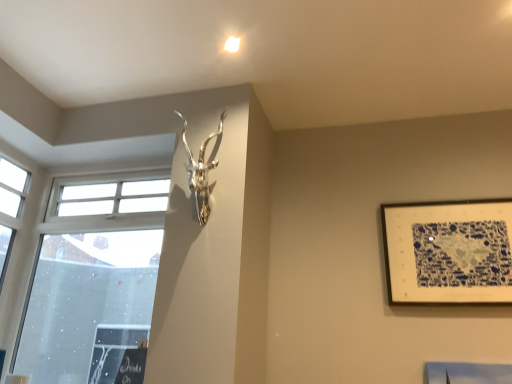
What do you see at coordinates (92, 278) in the screenshot? This screenshot has height=384, width=512. I see `transparent glass window at left` at bounding box center [92, 278].

This screenshot has height=384, width=512. I want to click on blue and white paper at upper right, so click(x=449, y=251).

Is blue and white paper at upper right bigger or smaller than silver metallic antler at upper center?

In the image, blue and white paper at upper right appears to be smaller than silver metallic antler at upper center.

Considering the positions of objects blue and white paper at upper right and silver metallic antler at upper center in the image provided, who is in front, blue and white paper at upper right or silver metallic antler at upper center?

silver metallic antler at upper center.

Would you say blue and white paper at upper right is to the left or to the right of transparent glass window at left in the picture?

blue and white paper at upper right is to the right of transparent glass window at left.

Is blue and white paper at upper right next to transparent glass window at left?

No.

From a real-world perspective, is blue and white paper at upper right above or below transparent glass window at left?

In terms of real-world spatial position, blue and white paper at upper right is above transparent glass window at left.

Is blue and white paper at upper right located outside transparent glass window at left?

Indeed, blue and white paper at upper right is completely outside transparent glass window at left.

Based on the photo, which of these two, transparent glass window at left or blue and white paper at upper right, stands taller?

transparent glass window at left is taller.

Is transparent glass window at left in contact with blue and white paper at upper right?

No, transparent glass window at left is not next to blue and white paper at upper right.

Between transparent glass window at left and blue and white paper at upper right, which one has larger width?

transparent glass window at left.

Does point (57, 258) come closer to viewer compared to point (417, 287)?

No, it is not.

Between silver metallic antler at upper center and transparent glass window at left, which one appears on the left side from the viewer's perspective?

From the viewer's perspective, transparent glass window at left appears more on the left side.

Between silver metallic antler at upper center and transparent glass window at left, which one has more height?

transparent glass window at left is taller.

Is silver metallic antler at upper center positioned beyond the bounds of transparent glass window at left?

Yes, silver metallic antler at upper center is not within transparent glass window at left.

Between point (203, 221) and point (464, 228), which one is positioned in front?

The point (203, 221) is closer to the camera.

From the image's perspective, is silver metallic antler at upper center on top of blue and white paper at upper right?

Indeed, from the image's perspective, silver metallic antler at upper center is shown above blue and white paper at upper right.

Is blue and white paper at upper right at the back of silver metallic antler at upper center?

No.

Is silver metallic antler at upper center next to blue and white paper at upper right?

There is a gap between silver metallic antler at upper center and blue and white paper at upper right.

Is transparent glass window at left next to silver metallic antler at upper center?

No, transparent glass window at left is not in contact with silver metallic antler at upper center.

From their relative heights in the image, would you say transparent glass window at left is taller or shorter than silver metallic antler at upper center?

Considering their sizes, transparent glass window at left has more height than silver metallic antler at upper center.

Is point (49, 334) closer or farther from the camera than point (209, 139)?

Point (49, 334) appears to be farther away from the viewer than point (209, 139).

Does transparent glass window at left have a smaller size compared to silver metallic antler at upper center?

No.

Image resolution: width=512 pixels, height=384 pixels. What are the coordinates of `sculpture located on the left of blue and white paper at upper right` in the screenshot? It's located at (200, 171).

At what (x,y) coordinates should I click in order to perform the action: click on picture frame on the right of transparent glass window at left. Please return your answer as a coordinate pair (x, y). The width and height of the screenshot is (512, 384). Looking at the image, I should click on (449, 251).

Looking at the image, which one is located closer to transparent glass window at left, silver metallic antler at upper center or blue and white paper at upper right?

Among the two, silver metallic antler at upper center is located nearer to transparent glass window at left.

From the image, which object appears to be nearer to blue and white paper at upper right, silver metallic antler at upper center or transparent glass window at left?

The object closer to blue and white paper at upper right is silver metallic antler at upper center.

Looking at this image, when comparing their distances from silver metallic antler at upper center, does transparent glass window at left or blue and white paper at upper right seem further?

The object further to silver metallic antler at upper center is blue and white paper at upper right.

Estimate the real-world distances between objects in this image. Which object is closer to silver metallic antler at upper center, blue and white paper at upper right or transparent glass window at left?

The object closer to silver metallic antler at upper center is transparent glass window at left.

Based on their spatial positions, is transparent glass window at left or silver metallic antler at upper center further from blue and white paper at upper right?

Among the two, transparent glass window at left is located further to blue and white paper at upper right.

Which object lies nearer to the anchor point transparent glass window at left, blue and white paper at upper right or silver metallic antler at upper center?

The object closer to transparent glass window at left is silver metallic antler at upper center.

Where is `sculpture located between transparent glass window at left and blue and white paper at upper right in the left-right direction`? The image size is (512, 384). sculpture located between transparent glass window at left and blue and white paper at upper right in the left-right direction is located at coordinates 200,171.